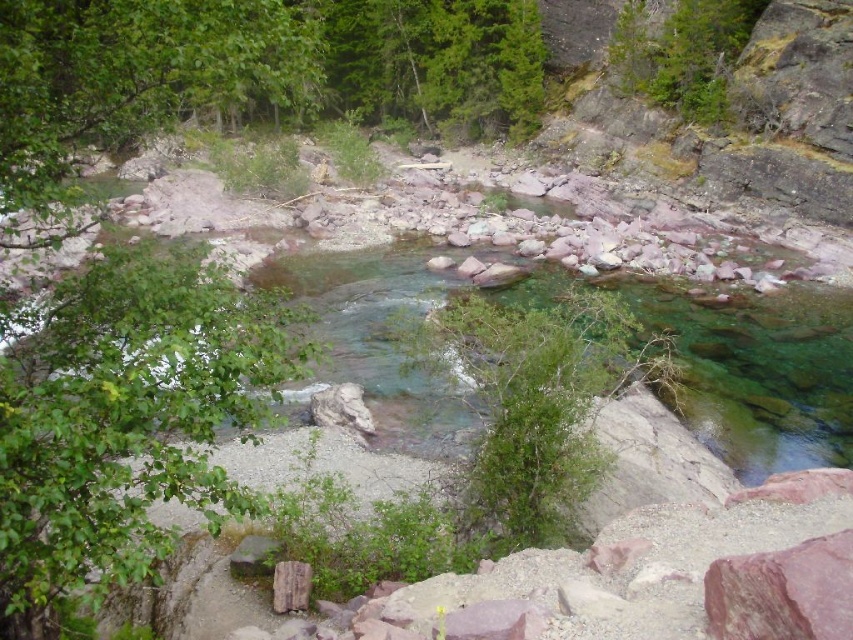
You are standing at the edge of the river and want to reach the green leafy bush at center. Based on the coordinates provided, is the bush directly across the river from your current position?

The green leafy bush at center is located at point (540, 403), which means it is positioned centrally in the scene. Since you are at the edge of the river, the bush is directly across the river from your position.

You are a hiker trying to cross the river at the center. You see the green leafy bush at center and the brown rough stone at center. Which object is closer to you as you approach the river?

The green leafy bush at center is closer to you because it is in front of the brown rough stone at center.

Looking at this image, you are standing at the camera position and want to reach the green leafy bush at center. If your walking speed is 1.2 meters per second, how many seconds will it take you to reach the bush?

The distance between you and the green leafy bush at center is 7.92 meters. At a speed of 1.2 meters per second, dividing 7.92 by 1.2 gives 6.6 seconds. Therefore, it will take approximately 6.6 seconds to reach the bush.